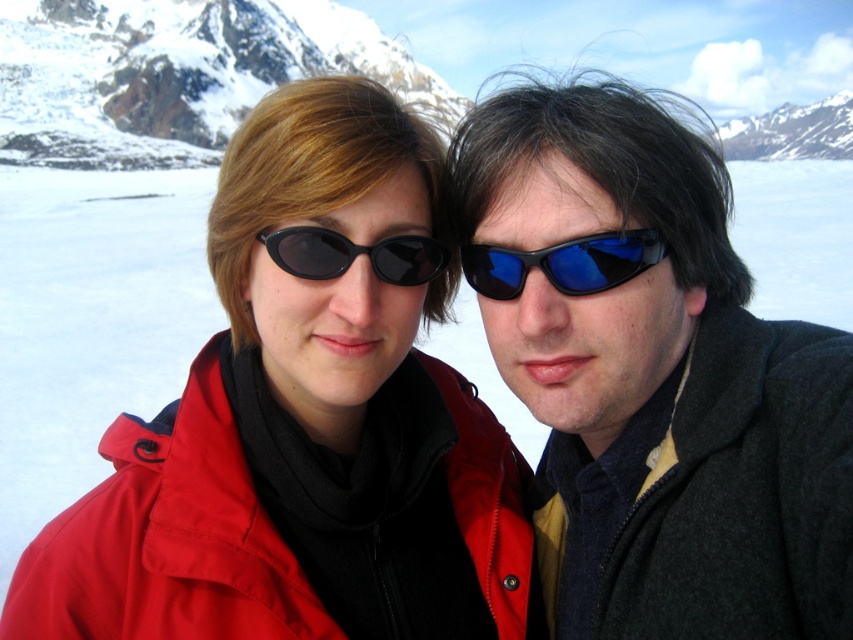
Does matte red jacket at center come behind snowy granite mountain at upper left?

No, matte red jacket at center is in front of snowy granite mountain at upper left.

Who is more distant from viewer, (161, 532) or (4, 116)?

Positioned behind is point (4, 116).

Find the location of a particular element. This screenshot has width=853, height=640. matte red jacket at center is located at coordinates (167, 540).

Looking at this image, which is more to the right, matte red jacket at center or blue reflective plastic sunglasses at center?

From the viewer's perspective, blue reflective plastic sunglasses at center appears more on the right side.

At what (x,y) coordinates should I click in order to perform the action: click on matte red jacket at center. Please return your answer as a coordinate pair (x, y). Looking at the image, I should click on (167, 540).

Does matte black jacket at right have a lesser width compared to black matte sunglasses at center?

In fact, matte black jacket at right might be wider than black matte sunglasses at center.

Does matte black jacket at right appear over black matte sunglasses at center?

No, matte black jacket at right is not above black matte sunglasses at center.

Describe the element at coordinates (653, 376) in the screenshot. I see `matte black jacket at right` at that location.

Where is `matte black jacket at right`? The height and width of the screenshot is (640, 853). matte black jacket at right is located at coordinates (653, 376).